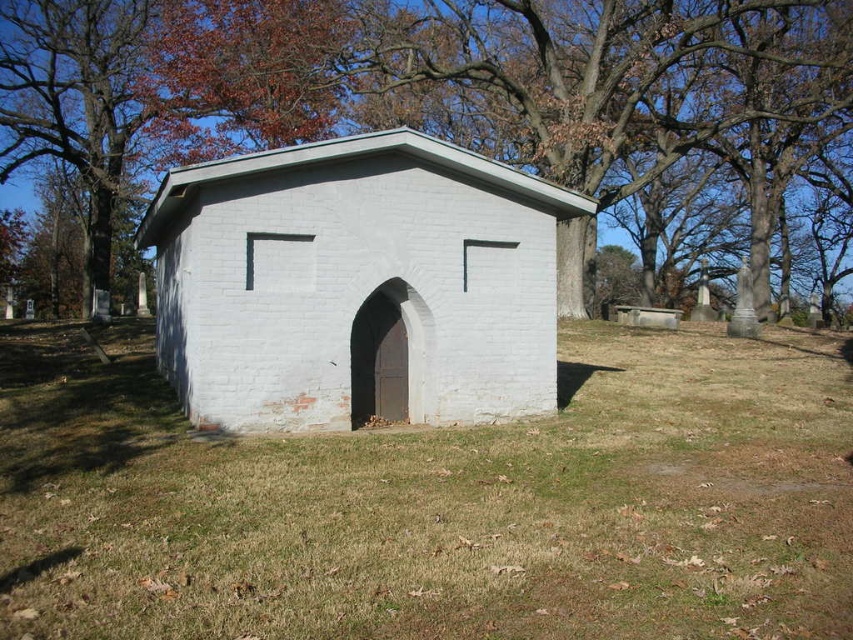
Does point (734, 81) lie behind point (300, 252)?

Yes, point (734, 81) is behind point (300, 252).

Which is more to the right, brown wood tree at upper center or white brick hut at center?

Positioned to the right is brown wood tree at upper center.

I want to click on brown wood tree at upper center, so click(434, 84).

Between brown wood tree at upper center and brown leafy tree at upper left, which one has less height?

With less height is brown leafy tree at upper left.

At what (x,y) coordinates should I click in order to perform the action: click on brown wood tree at upper center. Please return your answer as a coordinate pair (x, y). Image resolution: width=853 pixels, height=640 pixels. Looking at the image, I should click on (434, 84).

Which is more to the right, white brick hut at center or brown leafy tree at upper left?

Positioned to the right is white brick hut at center.

Is white brick hut at center positioned behind brown leafy tree at upper left?

No, white brick hut at center is closer to the viewer.

The height and width of the screenshot is (640, 853). Describe the element at coordinates (357, 284) in the screenshot. I see `white brick hut at center` at that location.

What are the coordinates of `white brick hut at center` in the screenshot? It's located at pyautogui.click(x=357, y=284).